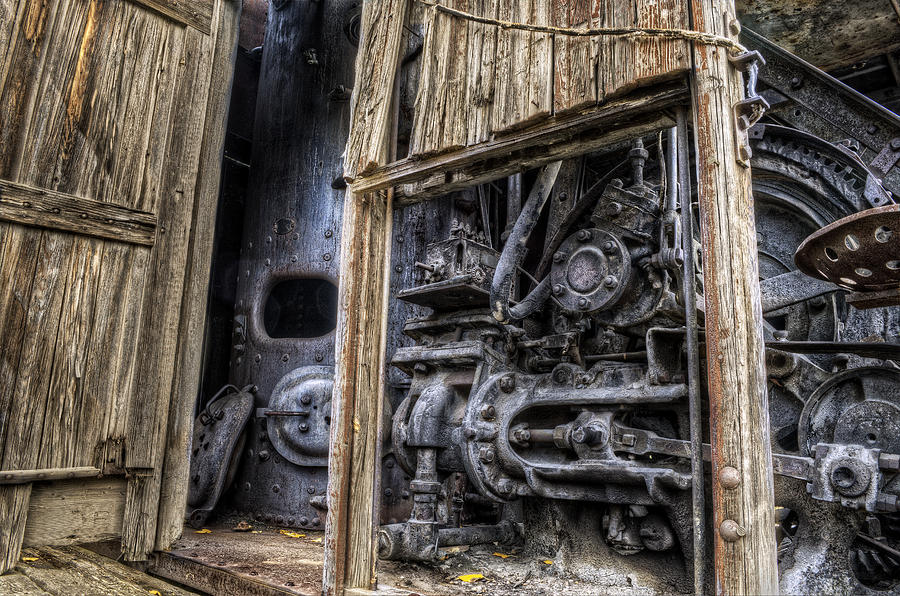
I want to click on wooden post left of opening, so click(356, 368).